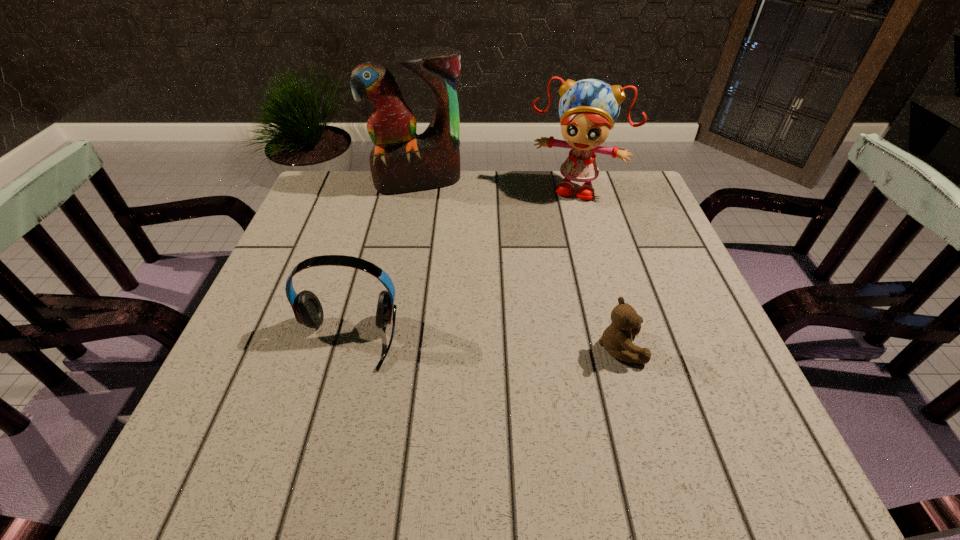
You are a GUI agent. You are given a task and a screenshot of the screen. Output one action in this format:
    pyautogui.click(x=<x>, y=<y>)
    Task: Click on the free spot between the tallest object and the doll
    The image size is (960, 540).
    Given the screenshot: What is the action you would take?
    pyautogui.click(x=496, y=184)

At what (x,y) coordinates should I click in order to perform the action: click on empty space between the headset and the parrot. Please return your answer as a coordinate pair (x, y). The height and width of the screenshot is (540, 960). Looking at the image, I should click on (382, 261).

Image resolution: width=960 pixels, height=540 pixels. In order to click on vacant point located between the third shortest object and the headset in this screenshot , I will do `click(461, 263)`.

At what (x,y) coordinates should I click in order to perform the action: click on vacant area between the headset and the shortest object. Please return your answer as a coordinate pair (x, y). Looking at the image, I should click on (483, 344).

You are a GUI agent. You are given a task and a screenshot of the screen. Output one action in this format:
    pyautogui.click(x=<x>, y=<y>)
    Task: Click on the empty location between the teddy bear and the tallest object
    
    Given the screenshot: What is the action you would take?
    pyautogui.click(x=519, y=265)

Locate an element on the screen. vacant point located between the doll and the teddy bear is located at coordinates (598, 267).

Find the location of a particular element. This screenshot has width=960, height=540. free space between the third shortest object and the headset is located at coordinates [461, 263].

Identify the location of vacant space in between the doll and the tallest object. This screenshot has width=960, height=540. (496, 184).

Identify which object is the third closest to the parrot. Please provide its 2D coordinates. Your answer should be formatted as a tuple, i.e. [(x, y)], where the tuple contains the x and y coordinates of a point satisfying the conditions above.

[(617, 338)]

Select which object appears as the second closest to the tallest object. Please provide its 2D coordinates. Your answer should be formatted as a tuple, i.e. [(x, y)], where the tuple contains the x and y coordinates of a point satisfying the conditions above.

[(308, 311)]